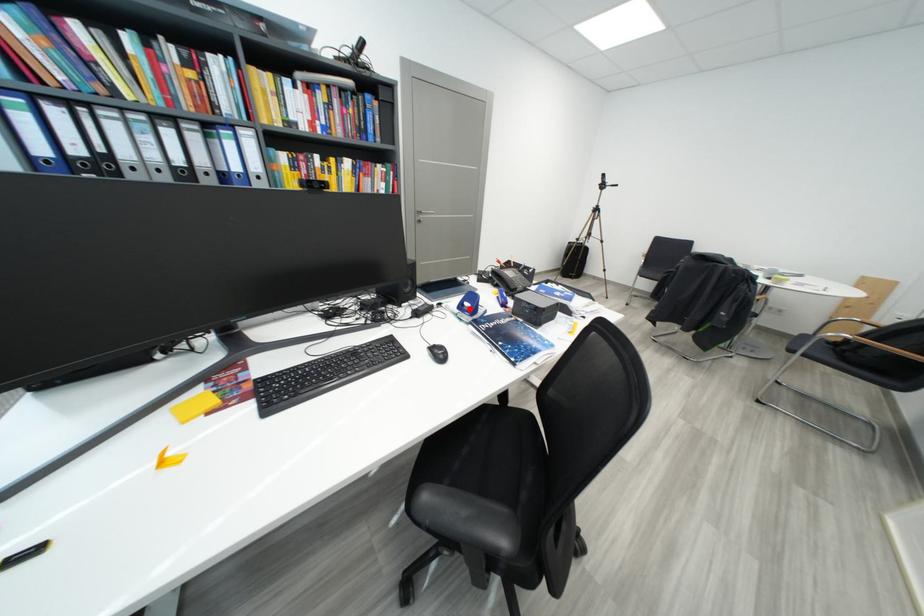
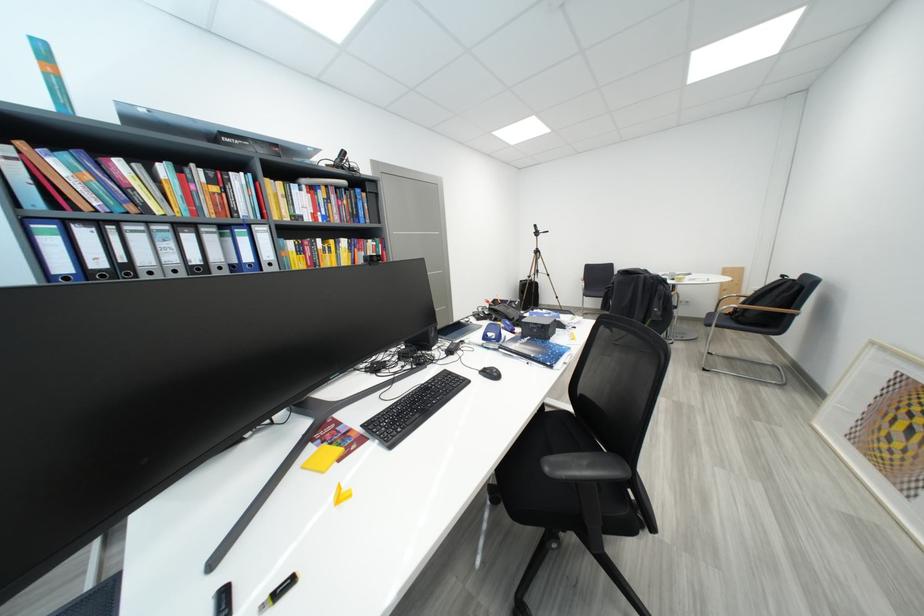
Where in the second image is the point corresponding to the highlighted location from the first image?

(494, 339)